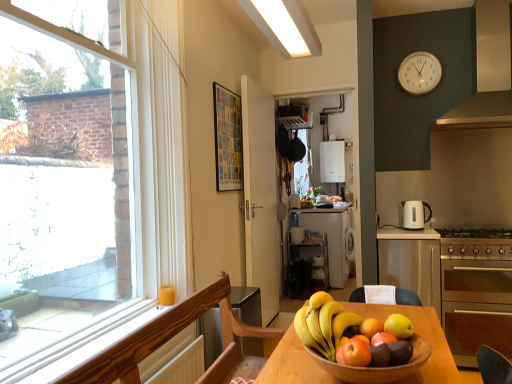
Question: Is point (376, 352) closer or farther from the camera than point (393, 319)?

Choices:
 (A) farther
 (B) closer

Answer: (B)

Question: Would you say shiny green apple at center, acting as the fifth apple starting from the back, is to the left or to the right of yellow matte apple at center, the fifth apple in the front-to-back sequence, in the picture?

Choices:
 (A) left
 (B) right

Answer: (A)

Question: Which object is the farthest from the shiny red apple at lower center, the fourth apple positioned from the back?

Choices:
 (A) satin silver cabinet at right
 (B) white plastic clock at upper right
 (C) wooden chair at lower left
 (D) wooden bowl at center
 (E) white glossy electric kettle at right

Answer: (B)

Question: Which object is positioned closest to the satin silver cabinet at right?

Choices:
 (A) satin silver exhaust hood at upper right
 (B) yellow matte apple at center, the fifth apple in the front-to-back sequence
 (C) shiny red apple at lower center, the fourth apple positioned from the back
 (D) wooden bowl at center
 (E) white glossy electric kettle at right

Answer: (E)